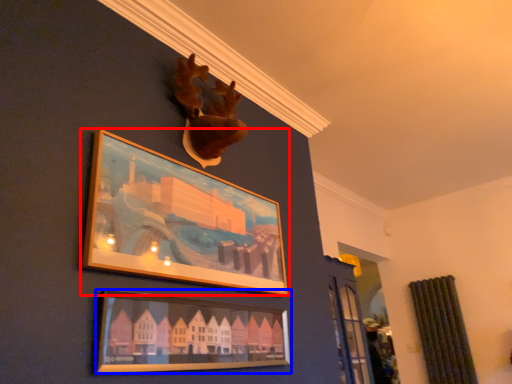
Question: Which object appears farthest to the camera in this image, picture frame (highlighted by a red box) or picture frame (highlighted by a blue box)?

Choices:
 (A) picture frame
 (B) picture frame

Answer: (A)